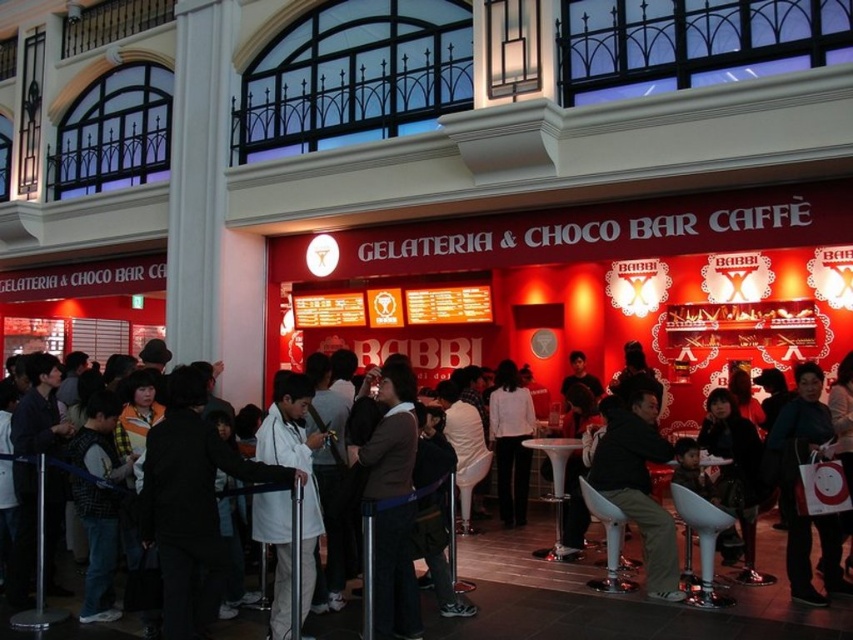
You are a customer entering the Babbi gelateria and choco bar. You see a white coat at center and a brown sweater at center hanging on the coat rack. Which one is closer to you?

The white coat at center is closer to you because it is in front of the brown sweater at center.

You are a customer standing outside the Babbi gelateria and choco bar. You notice two coats hanging at the center of the entrance. Which one is positioned lower between the white coat at center and the white matte coat at center?

The white coat at center is positioned lower because it is below the white matte coat at center.

You are a customer at the Babbi gelateria and choco bar. You see a white coat at center and a white paper bag at lower right. Which item is wider?

The white coat at center is wider than the white paper bag at lower right according to the description.